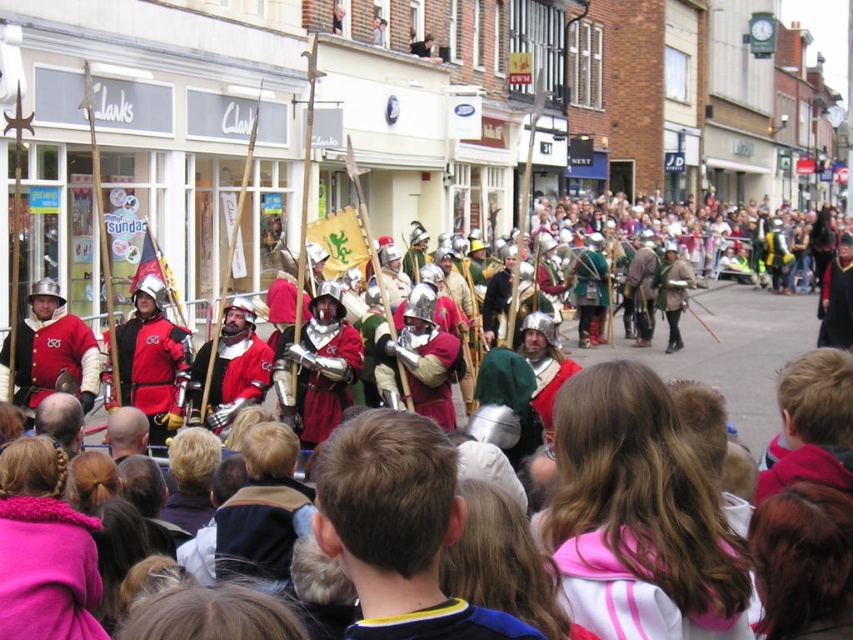
You are a photographer standing at the front of the crowd, and you want to take a closeup shot of the pink fabric jacket at center. Considering your camera can focus on subjects within 25 meters, will you be able to capture a clear image?

The pink fabric jacket at center is 26.26 meters from the viewer, which is beyond the camera focus range of 25 meters. Therefore, you won

You are a photographer at the medieval parade. You want to take a photo that includes both the pink fabric jacket at center and the matte red tunic at center. Which one should you focus on to ensure it stands out more in the photo?

The pink fabric jacket at center is larger in size than the matte red tunic at center, so focusing on the pink fabric jacket at center will make it stand out more in the photo.